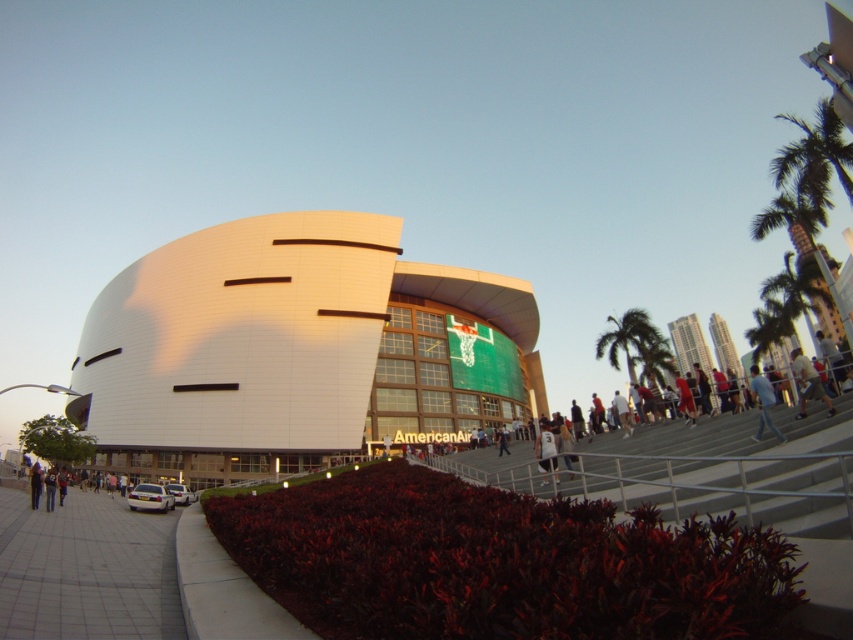
Question: Is white smooth building at center thinner than green leafy palm tree at right?

Choices:
 (A) yes
 (B) no

Answer: (B)

Question: Which is nearer to the white jersey at center?

Choices:
 (A) light blue jeans at right
 (B) white smooth building at center
 (C) dark blue jeans at lower left

Answer: (A)

Question: Is white smooth building at center wider than light blue jeans at right?

Choices:
 (A) yes
 (B) no

Answer: (A)

Question: Among these points, which one is nearest to the camera?

Choices:
 (A) (50, 499)
 (B) (375, 262)
 (C) (544, 422)
 (D) (807, 365)

Answer: (D)

Question: Among these objects, which one is nearest to the camera?

Choices:
 (A) white jersey at center
 (B) blue denim jeans at lower left
 (C) blue jeans at lower right

Answer: (C)

Question: Is green leafy palm tree at right positioned before blue denim jeans at lower left?

Choices:
 (A) no
 (B) yes

Answer: (A)